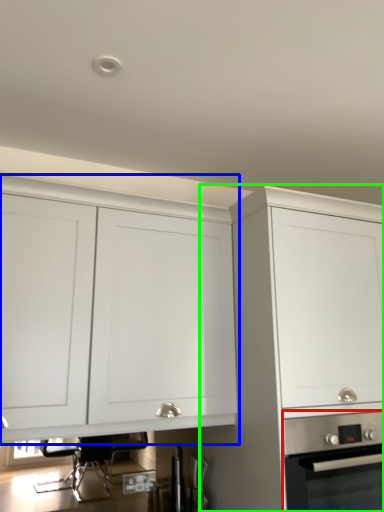
Question: Estimate the real-world distances between objects in this image. Which object is closer to home appliance (highlighted by a red box), cabinetry (highlighted by a blue box) or cabinetry (highlighted by a green box)?

Choices:
 (A) cabinetry
 (B) cabinetry

Answer: (B)